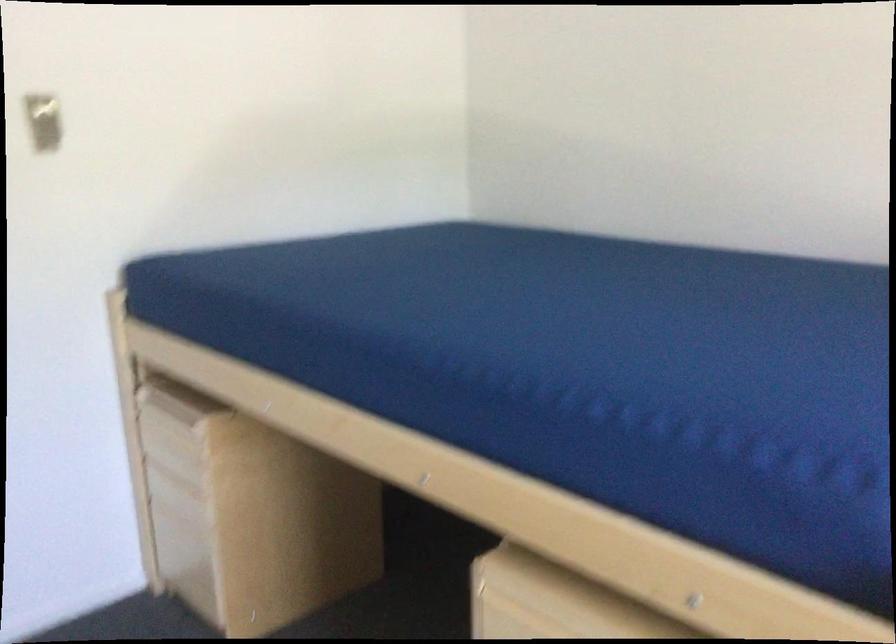
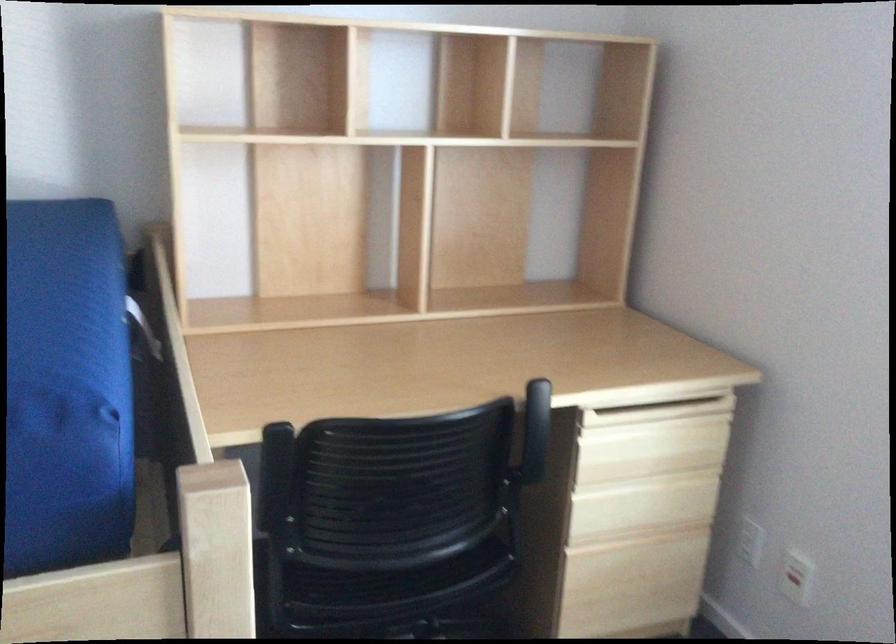
Question: The camera is either moving clockwise (left) or counter-clockwise (right) around the object. The first image is from the beginning of the video and the second image is from the end. Is the camera moving left or right when shooting the video?

Choices:
 (A) Left
 (B) Right

Answer: (A)